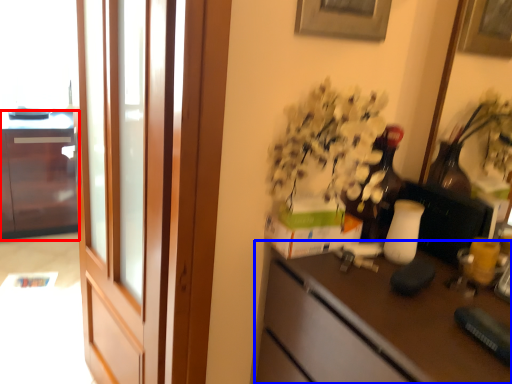
Question: Which point is closer to the camera, cabinetry (highlighted by a red box) or desk (highlighted by a blue box)?

Choices:
 (A) cabinetry
 (B) desk

Answer: (B)